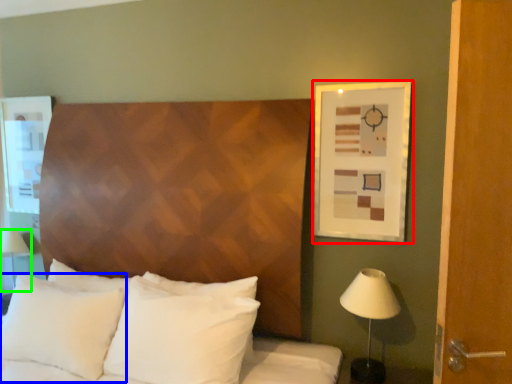
Question: Which object is positioned closest to picture frame (highlighted by a red box)? Select from pillow (highlighted by a blue box) and table lamp (highlighted by a green box).

Choices:
 (A) pillow
 (B) table lamp

Answer: (A)